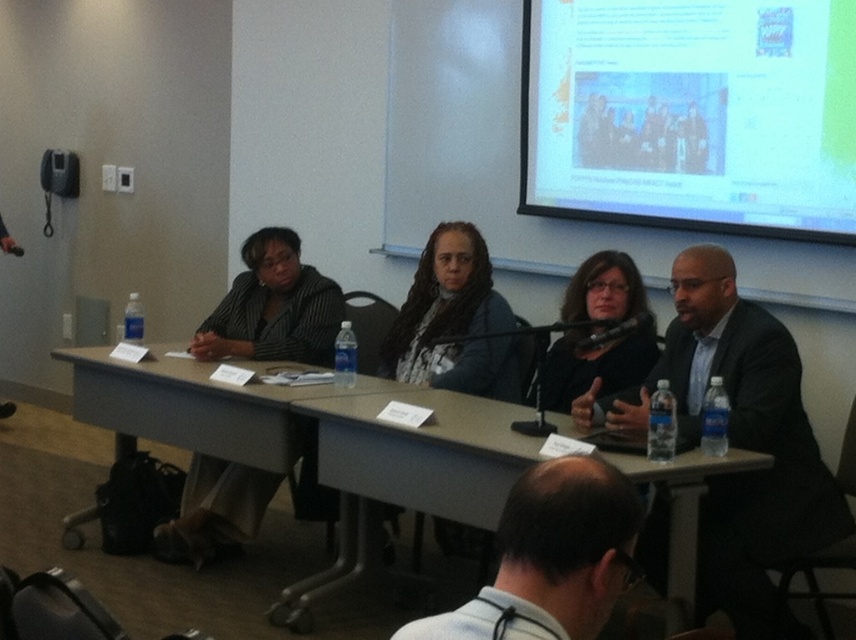
You are organizing a small workshop and need to place a 1.2 meter long laptop stand on the table. Given the light brown wood table at center and the striped fabric jacket at center, can the laptop stand fit on the table?

The light brown wood table at center is bigger than the striped fabric jacket at center. However, the exact dimensions of the table are unknown. Without knowing the table length, it is impossible to confirm if the 1.2 meter laptop stand will fit.

Based on the scene description, can you determine which object is larger between the white glossy projector screen at upper right and the black suit at center?

The white glossy projector screen at upper right is bigger than the black suit at center according to the description.

Consider the image. You are a participant in the panel discussion and need to adjust the lighting to better see the white glossy projector screen at upper right. Where should you look to find the screen?

The white glossy projector screen at upper right is located at point (691, 115), so you should look towards the upper right direction to find it.